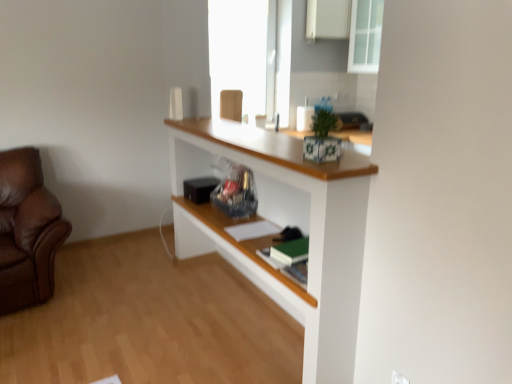
Question: Does transparent glass cabinet at upper right come behind white plastic electric outlet at lower right?

Choices:
 (A) no
 (B) yes

Answer: (B)

Question: Can you confirm if transparent glass cabinet at upper right is positioned to the left of white plastic electric outlet at lower right?

Choices:
 (A) yes
 (B) no

Answer: (B)

Question: Is transparent glass cabinet at upper right wider than white plastic electric outlet at lower right?

Choices:
 (A) no
 (B) yes

Answer: (B)

Question: Is transparent glass cabinet at upper right thinner than white plastic electric outlet at lower right?

Choices:
 (A) no
 (B) yes

Answer: (A)

Question: Is white plastic electric outlet at lower right a part of transparent glass cabinet at upper right?

Choices:
 (A) no
 (B) yes

Answer: (A)

Question: Is transparent glass cabinet at upper right in contact with white plastic electric outlet at lower right?

Choices:
 (A) no
 (B) yes

Answer: (A)

Question: Is transparent glass cabinet at upper right to the right of white matte cabinet at upper center from the viewer's perspective?

Choices:
 (A) yes
 (B) no

Answer: (A)

Question: From a real-world perspective, is transparent glass cabinet at upper right under white matte cabinet at upper center?

Choices:
 (A) yes
 (B) no

Answer: (A)

Question: Can you confirm if transparent glass cabinet at upper right is wider than white matte cabinet at upper center?

Choices:
 (A) yes
 (B) no

Answer: (A)

Question: Could you tell me if transparent glass cabinet at upper right is turned towards white matte cabinet at upper center?

Choices:
 (A) no
 (B) yes

Answer: (A)

Question: Can you confirm if transparent glass cabinet at upper right is taller than white matte cabinet at upper center?

Choices:
 (A) yes
 (B) no

Answer: (A)

Question: From a real-world perspective, is transparent glass cabinet at upper right positioned over white matte cabinet at upper center based on gravity?

Choices:
 (A) no
 (B) yes

Answer: (A)

Question: From a real-world perspective, is white matte cabinet at upper center located beneath green matte book at center, placed as the first book when sorted from front to back?

Choices:
 (A) yes
 (B) no

Answer: (B)